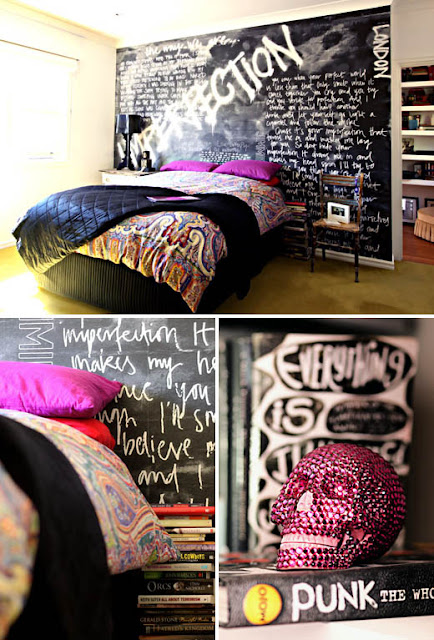
Where is `"imperfection" in white paint`? This screenshot has height=640, width=434. "imperfection" in white paint is located at coordinates (420, 251), (131, 147).